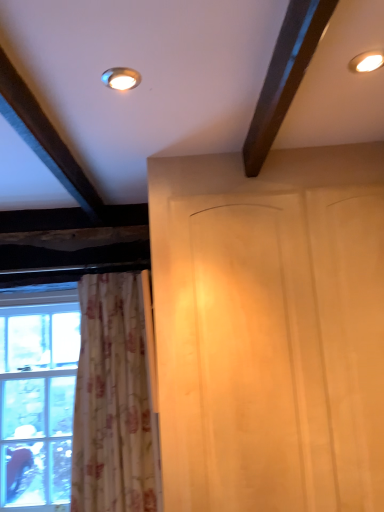
Question: From the image's perspective, is white wood screen door at center under white floral fabric curtain at left?

Choices:
 (A) yes
 (B) no

Answer: (B)

Question: Would you say white wood screen door at center is a long distance from white floral fabric curtain at left?

Choices:
 (A) no
 (B) yes

Answer: (A)

Question: Is white wood screen door at center at the left side of white floral fabric curtain at left?

Choices:
 (A) no
 (B) yes

Answer: (A)

Question: Is white wood screen door at center outside white floral fabric curtain at left?

Choices:
 (A) yes
 (B) no

Answer: (A)

Question: From a real-world perspective, is white wood screen door at center over white floral fabric curtain at left?

Choices:
 (A) no
 (B) yes

Answer: (B)

Question: Considering the positions of point (137, 73) and point (39, 493), is point (137, 73) closer or farther from the camera than point (39, 493)?

Choices:
 (A) farther
 (B) closer

Answer: (B)

Question: In terms of height, does matte gold light fixture at upper center, positioned as the 1th lighting in left-to-right order, look taller or shorter compared to clear glass window at left?

Choices:
 (A) tall
 (B) short

Answer: (B)

Question: From a real-world perspective, relative to clear glass window at left, is matte gold light fixture at upper center, the 1th lighting positioned from the bottom, vertically above or below?

Choices:
 (A) above
 (B) below

Answer: (A)

Question: Looking at the image, does matte gold light fixture at upper center, the 1th lighting positioned from the bottom, seem bigger or smaller compared to clear glass window at left?

Choices:
 (A) big
 (B) small

Answer: (B)

Question: In terms of width, does white wood screen door at center look wider or thinner when compared to clear glass window at left?

Choices:
 (A) wide
 (B) thin

Answer: (A)

Question: Considering the positions of white wood screen door at center and clear glass window at left in the image, is white wood screen door at center bigger or smaller than clear glass window at left?

Choices:
 (A) big
 (B) small

Answer: (A)

Question: From a real-world perspective, is white wood screen door at center physically located above or below clear glass window at left?

Choices:
 (A) above
 (B) below

Answer: (A)

Question: From the image's perspective, is white wood screen door at center positioned above or below clear glass window at left?

Choices:
 (A) above
 (B) below

Answer: (A)

Question: Looking at the image, does matte gold light fixture at upper center, the 2th lighting when ordered from top to bottom, seem bigger or smaller compared to white wood screen door at center?

Choices:
 (A) small
 (B) big

Answer: (A)

Question: Is matte gold light fixture at upper center, which appears as the second lighting when viewed from the right, taller or shorter than white wood screen door at center?

Choices:
 (A) tall
 (B) short

Answer: (B)